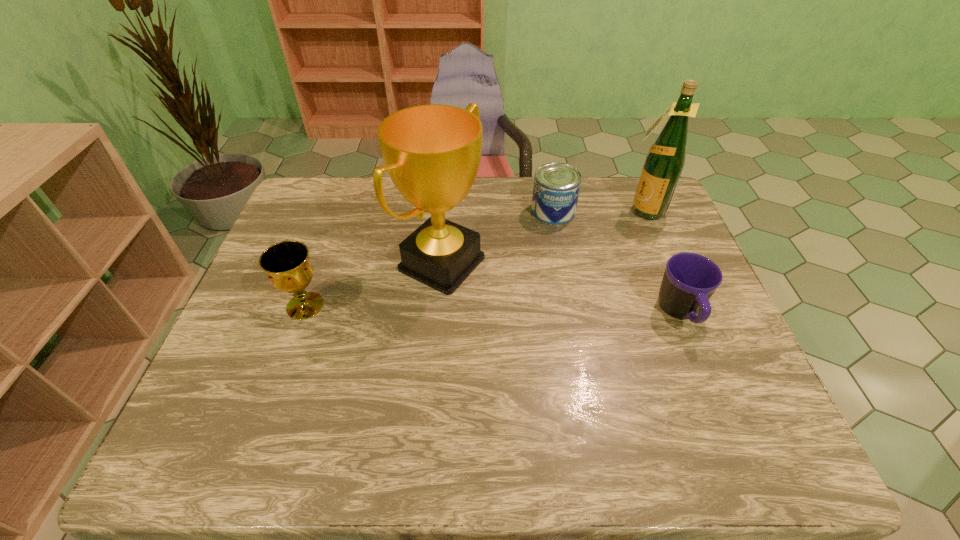
You are a GUI agent. You are given a task and a screenshot of the screen. Output one action in this format:
    pyautogui.click(x=<x>, y=<y>)
    Task: Click on the mug present at the right edge
    This screenshot has height=540, width=960.
    Given the screenshot: What is the action you would take?
    pos(689,281)

This screenshot has width=960, height=540. I want to click on liquor present at the right edge, so click(664, 163).

You are a GUI agent. You are given a task and a screenshot of the screen. Output one action in this format:
    pyautogui.click(x=<x>, y=<y>)
    Task: Click on the object present at the far right corner
    
    Given the screenshot: What is the action you would take?
    pyautogui.click(x=664, y=163)

I want to click on vacant space at the far edge, so click(348, 198).

Locate an element on the screen. The height and width of the screenshot is (540, 960). free space at the near edge is located at coordinates (297, 387).

The image size is (960, 540). I want to click on free location at the left edge, so click(220, 373).

In order to click on free space at the far left corner of the desktop in this screenshot , I will do `click(296, 217)`.

This screenshot has height=540, width=960. In order to click on free space at the far right corner of the desktop in this screenshot , I will do `click(630, 202)`.

The width and height of the screenshot is (960, 540). I want to click on free space at the near right corner of the desktop, so click(x=751, y=382).

Locate an element on the screen. Image resolution: width=960 pixels, height=540 pixels. free space that is in between the mug and the second object from left to right is located at coordinates (562, 288).